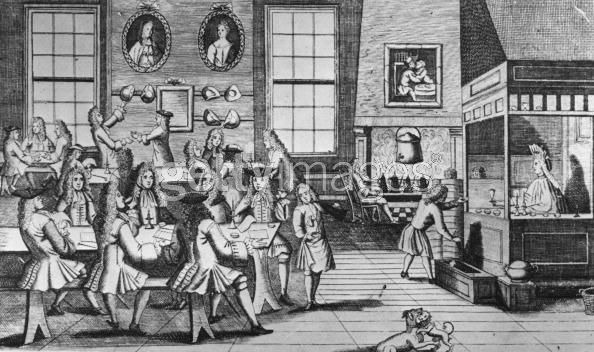
Locate an element on the screen. Image resolution: width=594 pixels, height=352 pixels. floor is located at coordinates (530, 327).